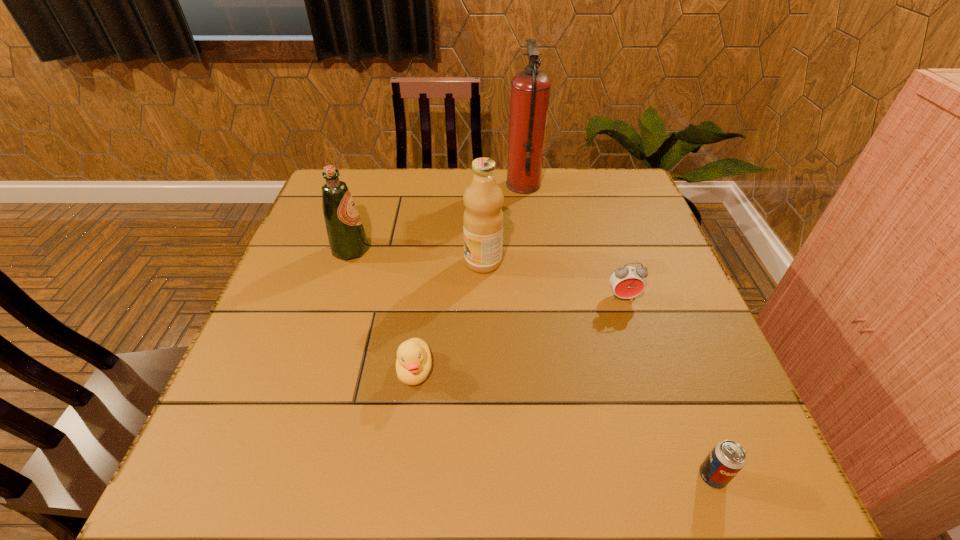
At what (x,y) coordinates should I click in order to perform the action: click on the fourth object from left to right. Please return your answer as a coordinate pair (x, y). This screenshot has height=540, width=960. Looking at the image, I should click on (530, 89).

Locate an element on the screen. The width and height of the screenshot is (960, 540). the farthest object is located at coordinates (530, 89).

Locate an element on the screen. the right olive oil is located at coordinates [x=483, y=198].

This screenshot has height=540, width=960. What are the coordinates of `the left olive oil` in the screenshot? It's located at (347, 239).

I want to click on the third tallest object, so click(347, 239).

Where is `the third shortest object`? The height and width of the screenshot is (540, 960). the third shortest object is located at coordinates (627, 282).

This screenshot has height=540, width=960. What are the coordinates of `the third nearest object` in the screenshot? It's located at (627, 282).

This screenshot has width=960, height=540. I want to click on the second object from left to right, so click(413, 364).

Find the location of a particular element. The height and width of the screenshot is (540, 960). duckling is located at coordinates (413, 364).

You are a GUI agent. You are given a task and a screenshot of the screen. Output one action in this format:
    pyautogui.click(x=<x>, y=<y>)
    Task: Click on the beer can
    The height and width of the screenshot is (540, 960).
    Given the screenshot: What is the action you would take?
    pyautogui.click(x=727, y=458)